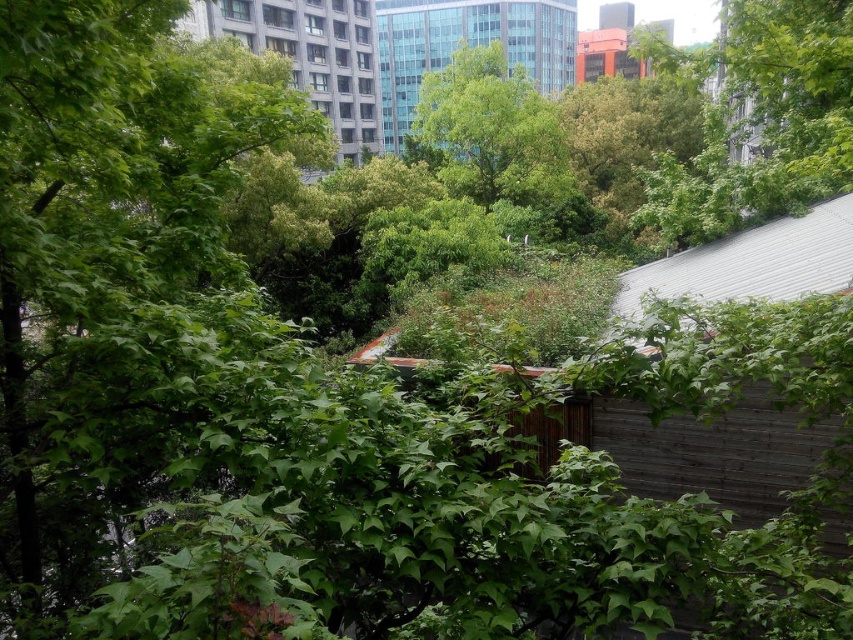
Question: Which point is farther to the camera?

Choices:
 (A) transparent glass building at upper center
 (B) wooden hut at upper center
 (C) matte orange building at upper center

Answer: (A)

Question: Observing the image, what is the correct spatial positioning of gray corrugated metal hut at right in reference to matte orange building at upper center?

Choices:
 (A) below
 (B) above

Answer: (A)

Question: Can you confirm if transparent glass building at upper center is positioned to the left of wooden hut at upper center?

Choices:
 (A) yes
 (B) no

Answer: (B)

Question: Can you confirm if wooden hut at upper center is positioned above matte orange building at upper center?

Choices:
 (A) no
 (B) yes

Answer: (A)

Question: Considering the real-world distances, which object is closest to the gray corrugated metal hut at right?

Choices:
 (A) wooden hut at upper center
 (B) matte orange building at upper center
 (C) transparent glass building at upper center

Answer: (A)

Question: Considering the real-world distances, which object is closest to the gray corrugated metal hut at right?

Choices:
 (A) matte orange building at upper center
 (B) wooden hut at upper center
 (C) transparent glass building at upper center

Answer: (B)